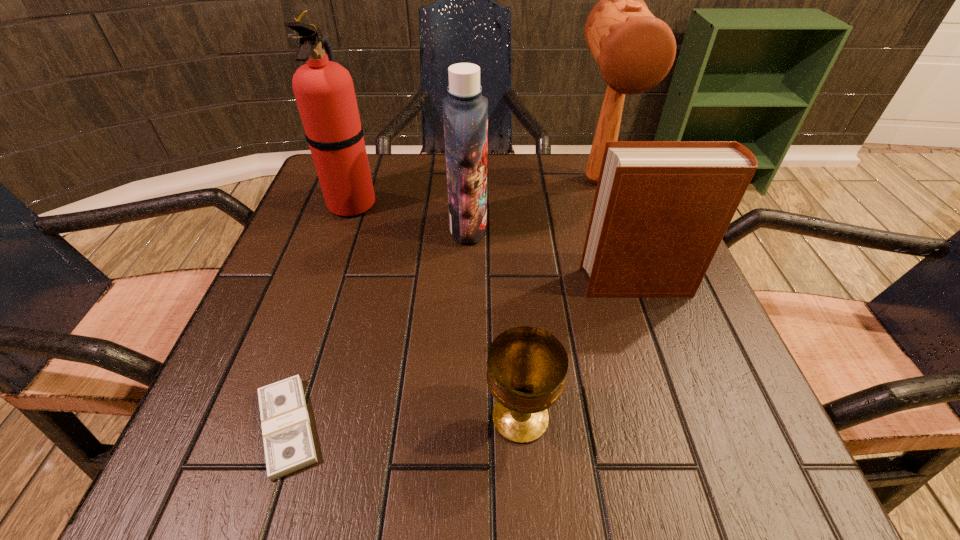
Where is `fire extinguisher`? The height and width of the screenshot is (540, 960). fire extinguisher is located at coordinates (324, 91).

You are a GUI agent. You are given a task and a screenshot of the screen. Output one action in this format:
    pyautogui.click(x=<x>, y=<y>)
    Task: Click on the mallet
    The height and width of the screenshot is (540, 960).
    Given the screenshot: What is the action you would take?
    pyautogui.click(x=634, y=51)

Image resolution: width=960 pixels, height=540 pixels. I want to click on shampoo, so tap(465, 111).

Locate an element on the screen. Image resolution: width=960 pixels, height=540 pixels. the third shortest object is located at coordinates (661, 208).

At what (x,y) coordinates should I click in order to perform the action: click on the third nearest object. Please return your answer as a coordinate pair (x, y). This screenshot has height=540, width=960. Looking at the image, I should click on (661, 208).

At what (x,y) coordinates should I click in order to perform the action: click on the second shortest object. Please return your answer as a coordinate pair (x, y). The image size is (960, 540). Looking at the image, I should click on (527, 367).

At what (x,y) coordinates should I click in order to perform the action: click on dollar. Please return your answer as a coordinate pair (x, y). The image size is (960, 540). Looking at the image, I should click on (288, 443).

The image size is (960, 540). I want to click on free space located 0.310m at the nozzle of the fire extinguisher, so click(521, 203).

You are a GUI agent. You are given a task and a screenshot of the screen. Output one action in this format:
    pyautogui.click(x=<x>, y=<y>)
    Task: Click on the free space located 0.360m on the strike surface of the mallet
    This screenshot has height=540, width=960.
    Given the screenshot: What is the action you would take?
    pyautogui.click(x=653, y=345)

Identify the location of free space located on the front label of the shampoo. (611, 227).